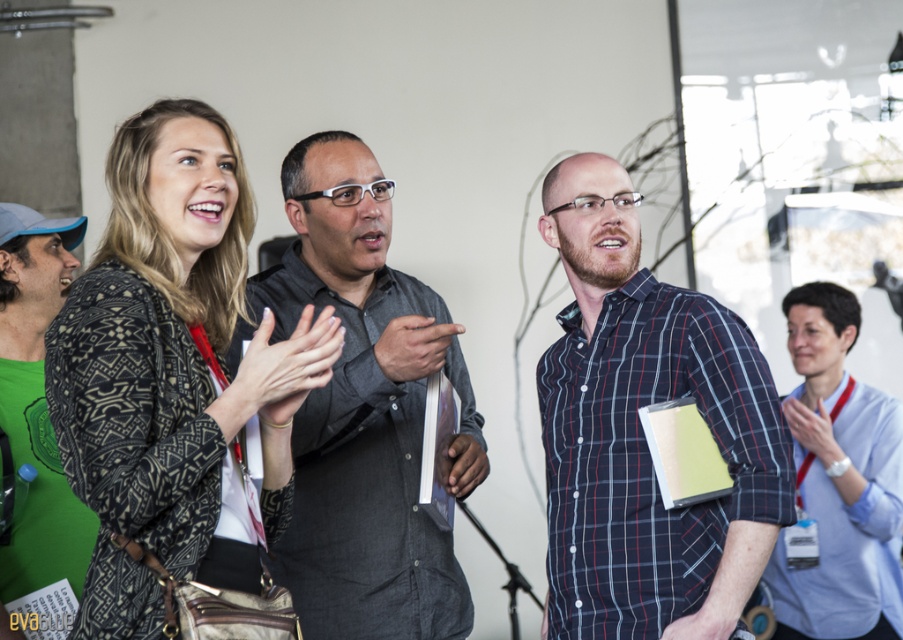
Is dark gray shirt at center to the right of green matte t-shirt at left from the viewer's perspective?

Correct, you'll find dark gray shirt at center to the right of green matte t-shirt at left.

Who is more distant from viewer, (x=365, y=163) or (x=26, y=244)?

The point (x=26, y=244) is more distant.

This screenshot has height=640, width=903. Identify the location of dark gray shirt at center. (364, 412).

Does patterned fabric jacket at center come in front of dark gray shirt at center?

Yes, it is.

Does patterned fabric jacket at center have a lesser width compared to dark gray shirt at center?

Indeed, patterned fabric jacket at center has a lesser width compared to dark gray shirt at center.

At what (x,y) coordinates should I click in order to perform the action: click on patterned fabric jacket at center. Please return your answer as a coordinate pair (x, y). Image resolution: width=903 pixels, height=640 pixels. Looking at the image, I should click on (172, 371).

The width and height of the screenshot is (903, 640). I want to click on patterned fabric jacket at center, so click(x=172, y=371).

Does patterned fabric jacket at center have a lesser width compared to plaid cotton shirt at center?

Incorrect, patterned fabric jacket at center's width is not less than plaid cotton shirt at center's.

Which of these two, patterned fabric jacket at center or plaid cotton shirt at center, stands taller?

Standing taller between the two is plaid cotton shirt at center.

This screenshot has height=640, width=903. What do you see at coordinates (172, 371) in the screenshot?
I see `patterned fabric jacket at center` at bounding box center [172, 371].

Locate an element on the screen. This screenshot has height=640, width=903. patterned fabric jacket at center is located at coordinates (172, 371).